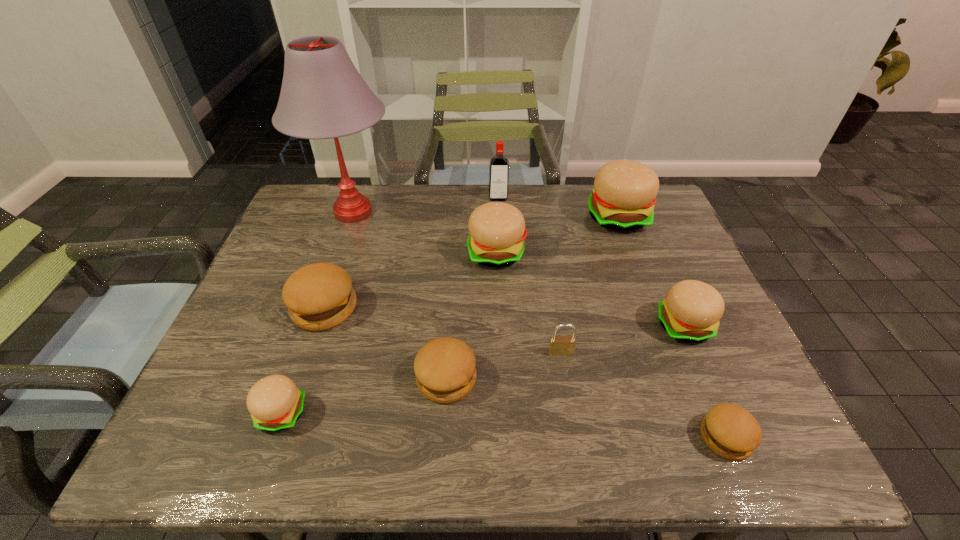
This screenshot has width=960, height=540. In order to click on vacant space at the near left corner of the desktop in this screenshot , I will do `click(225, 453)`.

Locate an element on the screen. This screenshot has width=960, height=540. free space between the sixth shortest hamburger and the leftmost brown hamburger is located at coordinates (410, 281).

The image size is (960, 540). Identify the location of blank region between the table lamp and the second nearest brown hamburger. (399, 295).

Locate an element on the screen. This screenshot has width=960, height=540. free space between the eighth shortest object and the farthest brown hamburger is located at coordinates (471, 262).

At what (x,y) coordinates should I click in order to perform the action: click on vacant space that's between the vodka and the smallest brown hamburger. Please return your answer as a coordinate pair (x, y). The image size is (960, 540). Looking at the image, I should click on (612, 318).

Where is `unoccupied position between the vodka and the second biggest brown hamburger`? This screenshot has width=960, height=540. unoccupied position between the vodka and the second biggest brown hamburger is located at coordinates (472, 288).

Where is `free point between the second brown hamburger from right to left and the padlock`? Image resolution: width=960 pixels, height=540 pixels. free point between the second brown hamburger from right to left and the padlock is located at coordinates (503, 366).

Where is `vacant area that lies between the fourth object from right to left and the red vodka`? vacant area that lies between the fourth object from right to left and the red vodka is located at coordinates (529, 275).

Point out which object is positioned as the fourth nearest to the second smallest beige hamburger. Please provide its 2D coordinates. Your answer should be formatted as a tuple, i.e. [(x, y)], where the tuple contains the x and y coordinates of a point satisfying the conditions above.

[(497, 230)]

Identify the location of object that is the fifth closest to the seventh shortest object. The width and height of the screenshot is (960, 540). (445, 368).